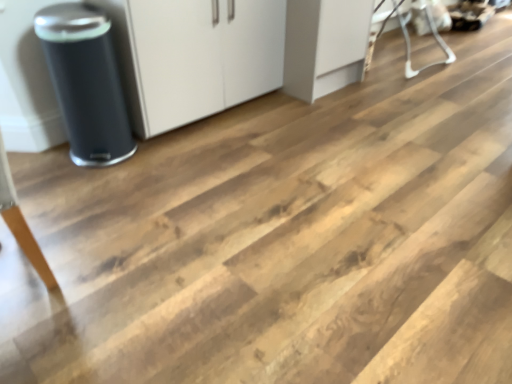
Question: Should I look upward or downward to see matte black trash can at left?

Choices:
 (A) up
 (B) down

Answer: (A)

Question: From the image's perspective, is white matte cabinet at center beneath matte black trash can at left?

Choices:
 (A) yes
 (B) no

Answer: (B)

Question: Is white matte cabinet at center not close to matte black trash can at left?

Choices:
 (A) no
 (B) yes

Answer: (A)

Question: Is white matte cabinet at center smaller than matte black trash can at left?

Choices:
 (A) no
 (B) yes

Answer: (A)

Question: Can you confirm if white matte cabinet at center is wider than matte black trash can at left?

Choices:
 (A) no
 (B) yes

Answer: (B)

Question: From a real-world perspective, is white matte cabinet at center on matte black trash can at left?

Choices:
 (A) yes
 (B) no

Answer: (A)

Question: Does white matte cabinet at center lie in front of matte black trash can at left?

Choices:
 (A) no
 (B) yes

Answer: (A)

Question: Is white plastic baby bouncer at upper right in front of white matte cabinet at center?

Choices:
 (A) no
 (B) yes

Answer: (A)

Question: Is white plastic baby bouncer at upper right next to white matte cabinet at center and touching it?

Choices:
 (A) yes
 (B) no

Answer: (B)

Question: From the image's perspective, is white plastic baby bouncer at upper right over white matte cabinet at center?

Choices:
 (A) no
 (B) yes

Answer: (B)

Question: From a real-world perspective, is white plastic baby bouncer at upper right positioned under white matte cabinet at center based on gravity?

Choices:
 (A) no
 (B) yes

Answer: (B)

Question: Considering the relative sizes of white plastic baby bouncer at upper right and white matte cabinet at center in the image provided, is white plastic baby bouncer at upper right shorter than white matte cabinet at center?

Choices:
 (A) yes
 (B) no

Answer: (A)

Question: Is white plastic baby bouncer at upper right to the right of white matte cabinet at center from the viewer's perspective?

Choices:
 (A) no
 (B) yes

Answer: (B)

Question: From a real-world perspective, is matte black trash can at left located beneath white plastic baby bouncer at upper right?

Choices:
 (A) yes
 (B) no

Answer: (B)